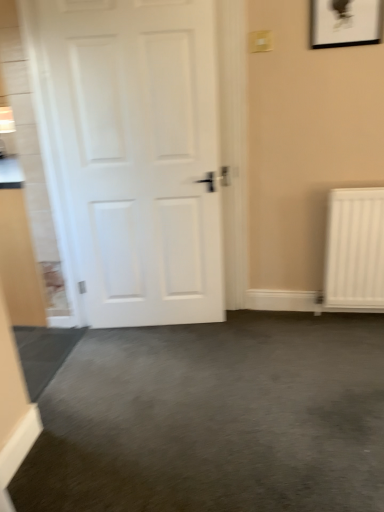
Locate an element on the screen. This screenshot has width=384, height=512. white matte door at left is located at coordinates (138, 156).

Describe the element at coordinates (138, 156) in the screenshot. I see `white matte door at left` at that location.

Describe the element at coordinates (345, 23) in the screenshot. I see `matte black picture frame at upper right` at that location.

You are a GUI agent. You are given a task and a screenshot of the screen. Output one action in this format:
    pyautogui.click(x=<x>, y=<y>)
    Task: Click on the matte black picture frame at upper right
    
    Given the screenshot: What is the action you would take?
    pyautogui.click(x=345, y=23)

What are the coordinates of `white matte door at left` in the screenshot? It's located at (138, 156).

In the image, is white matte door at left on the left side or the right side of matte black picture frame at upper right?

white matte door at left is to the left of matte black picture frame at upper right.

Which object is more forward, white matte door at left or matte black picture frame at upper right?

white matte door at left is closer to the camera.

Does point (209, 232) come farther from viewer compared to point (338, 41)?

Yes, it is behind point (338, 41).

From the image's perspective, is white matte door at left on top of matte black picture frame at upper right?

Incorrect, from the image's perspective, white matte door at left is lower than matte black picture frame at upper right.

From a real-world perspective, between white matte door at left and matte black picture frame at upper right, who is vertically lower?

white matte door at left is physically lower.

Which of these two, white matte door at left or matte black picture frame at upper right, is thinner?

matte black picture frame at upper right is thinner.

Is white matte door at left taller or shorter than matte black picture frame at upper right?

white matte door at left is taller than matte black picture frame at upper right.

Is white matte door at left smaller than matte black picture frame at upper right?

No, white matte door at left is not smaller than matte black picture frame at upper right.

Is matte black picture frame at upper right surrounded by white matte door at left?

No, matte black picture frame at upper right is not surrounded by white matte door at left.

Is white matte door at left far away from matte black picture frame at upper right?

Yes, white matte door at left and matte black picture frame at upper right are located far from each other.

Does white matte door at left turn towards matte black picture frame at upper right?

No.

Can you tell me how much white matte door at left and matte black picture frame at upper right differ in facing direction?

white matte door at left and matte black picture frame at upper right are facing 8.72 degrees away from each other.

I want to click on picture frame above the white matte door at left (from a real-world perspective), so [345, 23].

Is matte black picture frame at upper right to the right of white matte door at left from the viewer's perspective?

Correct, you'll find matte black picture frame at upper right to the right of white matte door at left.

Is the depth of matte black picture frame at upper right less than that of white matte door at left?

No.

Which is further, (346,17) or (186,307)?

→ The point (186,307) is behind.

From the image's perspective, which is above, matte black picture frame at upper right or white matte door at left?

From the image's view, matte black picture frame at upper right is above.

From a real-world perspective, is matte black picture frame at upper right positioned over white matte door at left based on gravity?

Yes, from a real-world perspective, matte black picture frame at upper right is over white matte door at left

Considering the relative sizes of matte black picture frame at upper right and white matte door at left in the image provided, is matte black picture frame at upper right wider than white matte door at left?

In fact, matte black picture frame at upper right might be narrower than white matte door at left.

Can you confirm if matte black picture frame at upper right is shorter than white matte door at left?

Correct, matte black picture frame at upper right is not as tall as white matte door at left.

Which of these two, matte black picture frame at upper right or white matte door at left, is smaller?

matte black picture frame at upper right.

Consider the image. Is matte black picture frame at upper right completely or partially outside of white matte door at left?

Absolutely, matte black picture frame at upper right is external to white matte door at left.

Is matte black picture frame at upper right next to white matte door at left and touching it?

No, matte black picture frame at upper right is not beside white matte door at left.

Is matte black picture frame at upper right turned away from white matte door at left?

That's not correct — matte black picture frame at upper right is not looking away from white matte door at left.

What's the angular difference between matte black picture frame at upper right and white matte door at left's facing directions?

They differ by 8.72 degrees in their facing directions.

You are a GUI agent. You are given a task and a screenshot of the screen. Output one action in this format:
    pyautogui.click(x=<x>, y=<y>)
    Task: Click on the door located underneath the matte black picture frame at upper right (from a real-world perspective)
    This screenshot has width=384, height=512.
    Given the screenshot: What is the action you would take?
    pyautogui.click(x=138, y=156)

There is a white matte door at left. Identify the location of picture frame above it (from a real-world perspective). (345, 23).

This screenshot has height=512, width=384. In order to click on picture frame above the white matte door at left (from the image's perspective) in this screenshot , I will do `click(345, 23)`.